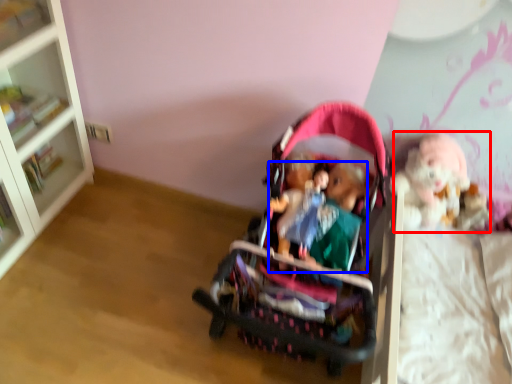
Question: Which of the following is the closest to the observer, doll (highlighted by a red box) or person (highlighted by a blue box)?

Choices:
 (A) doll
 (B) person

Answer: (B)